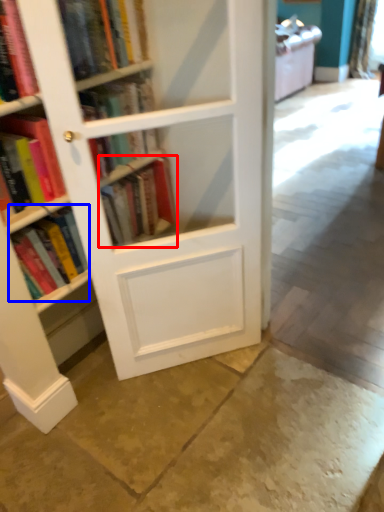
Question: Which object appears farthest to the camera in this image, book (highlighted by a red box) or book (highlighted by a blue box)?

Choices:
 (A) book
 (B) book

Answer: (A)